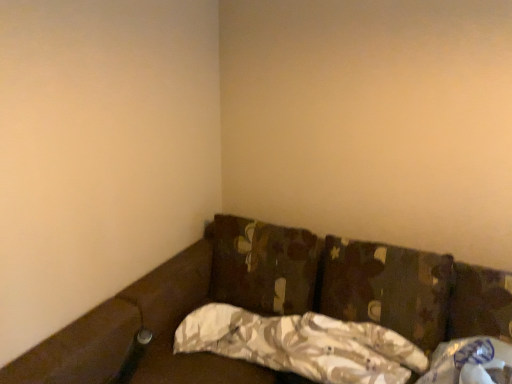
Question: Considering their positions, is camouflage fabric pillow at center, which is the second pillow in right-to-left order, located in front of or behind white plastic bag at lower right?

Choices:
 (A) front
 (B) behind

Answer: (B)

Question: Which is correct: camouflage fabric pillow at center, acting as the second pillow starting from the left, is inside white plastic bag at lower right, or outside of it?

Choices:
 (A) outside
 (B) inside

Answer: (A)

Question: Which of these objects is positioned farthest from the white plastic bag at lower right?

Choices:
 (A) camouflage fabric pillow at center, acting as the 1th pillow starting from the left
 (B) camouflage fabric pillow at center, which is the second pillow in right-to-left order
 (C) camo fabric pillow at center, the 3th pillow positioned from the left

Answer: (A)

Question: Estimate the real-world distances between objects in this image. Which object is closer to the camouflage fabric pillow at center, acting as the 1th pillow starting from the left?

Choices:
 (A) camo fabric pillow at center, the 3th pillow positioned from the left
 (B) camouflage fabric pillow at center, acting as the second pillow starting from the left
 (C) white plastic bag at lower right

Answer: (B)